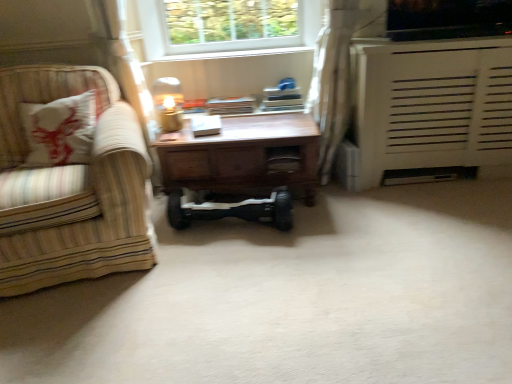
The width and height of the screenshot is (512, 384). I want to click on free point in front of matte gold table lamp at center, so click(174, 138).